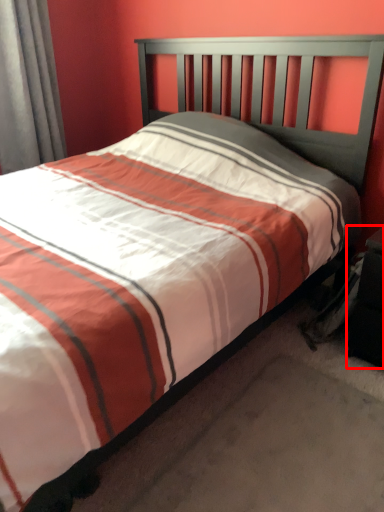
Question: From the image's perspective, considering the relative positions of nightstand (annotated by the red box) and curtain in the image provided, where is nightstand (annotated by the red box) located with respect to the staircase?

Choices:
 (A) above
 (B) below

Answer: (B)